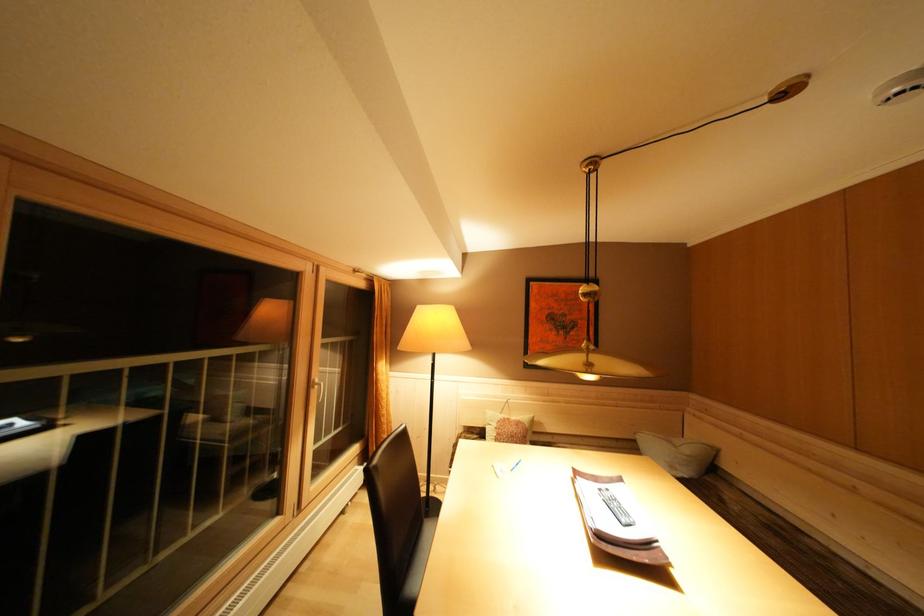
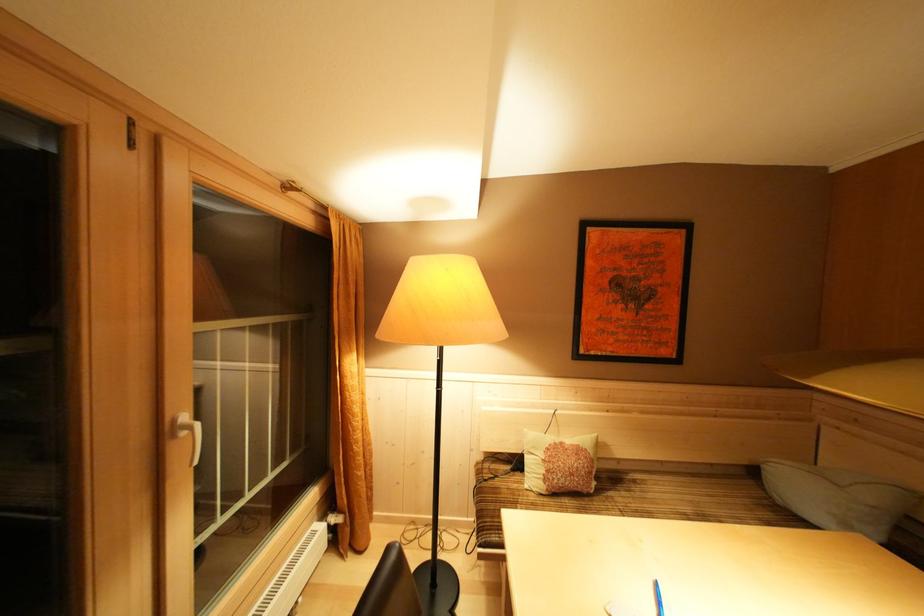
Question: In a continuous first-person perspective shot, in which direction is the camera moving?

Choices:
 (A) Left
 (B) Right
 (C) Forward
 (D) Backward

Answer: (C)